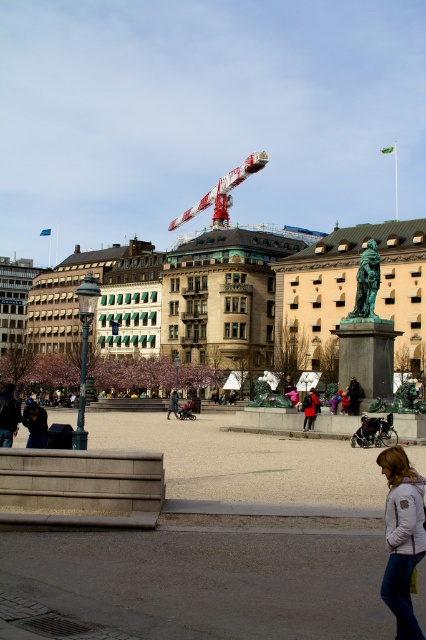
Question: Considering the relative positions of dark blue jeans at lower left and matte black jacket at center in the image provided, where is dark blue jeans at lower left located with respect to matte black jacket at center?

Choices:
 (A) left
 (B) right

Answer: (A)

Question: From the image, what is the correct spatial relationship of smooth concrete bench at lower left in relation to dark brown leather jacket at center?

Choices:
 (A) above
 (B) below

Answer: (A)

Question: Which of these objects is positioned closest to the green bronze statue at center?

Choices:
 (A) white fleece jacket at lower right
 (B) dark brown leather jacket at center
 (C) dark blue jeans at lower left
 (D) smooth concrete bench at lower left

Answer: (B)

Question: Which of these objects is positioned farthest from the green bronze statue at center?

Choices:
 (A) dark gray coat at center
 (B) matte black jacket at center
 (C) dark blue jeans at lower left
 (D) white painted metal crane at upper center

Answer: (D)

Question: Which of these objects is positioned closest to the dark blue jeans at lower left?

Choices:
 (A) dark gray coat at center
 (B) white painted metal crane at upper center
 (C) matte black jacket at center
 (D) dark brown leather jacket at center

Answer: (D)

Question: Can you confirm if dark blue jeans at lower left is bigger than dark gray coat at center?

Choices:
 (A) yes
 (B) no

Answer: (B)